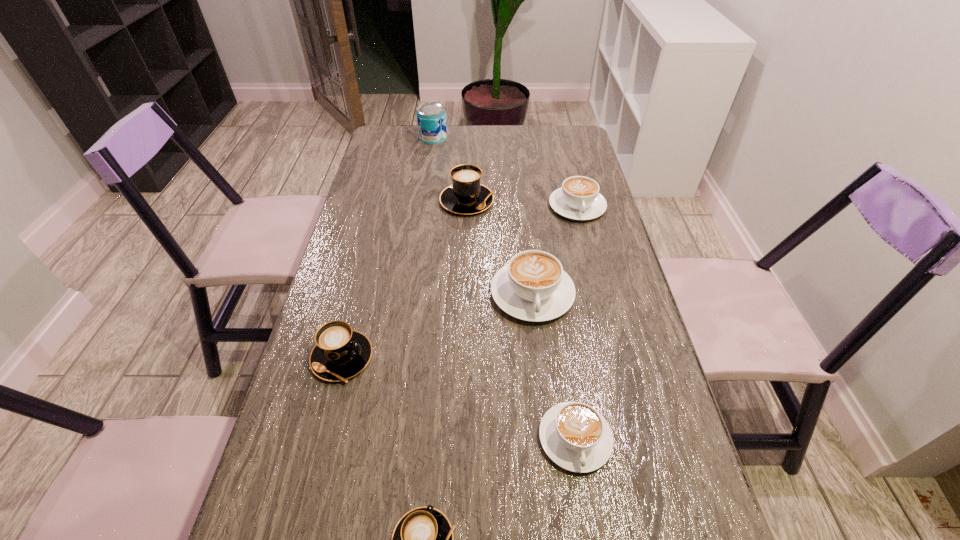
I want to click on can, so click(431, 117).

Where is `the farthest object`? This screenshot has width=960, height=540. the farthest object is located at coordinates (431, 117).

In order to click on the biggest black cappuccino in this screenshot , I will do `click(466, 195)`.

I want to click on the third farthest cappuccino, so click(x=533, y=286).

Where is `the biggest white cappuccino`? The height and width of the screenshot is (540, 960). the biggest white cappuccino is located at coordinates (533, 286).

At what (x,y) coordinates should I click in order to perform the action: click on the leftmost object. Please return your answer as a coordinate pair (x, y). The width and height of the screenshot is (960, 540). Looking at the image, I should click on (340, 353).

Where is `the leftmost cappuccino`? The image size is (960, 540). the leftmost cappuccino is located at coordinates (340, 353).

You are a GUI agent. You are given a task and a screenshot of the screen. Output one action in this format:
    pyautogui.click(x=<x>, y=<y>)
    Task: Click on the farthest white cappuccino
    The image size is (960, 540).
    Given the screenshot: What is the action you would take?
    pyautogui.click(x=579, y=198)

The height and width of the screenshot is (540, 960). Find the location of `the nearest white cappuccino`. the nearest white cappuccino is located at coordinates (575, 436).

At what (x,y) coordinates should I click in order to perform the action: click on the second nearest cappuccino. Please return your answer as a coordinate pair (x, y). The image size is (960, 540). Looking at the image, I should click on (x=575, y=436).